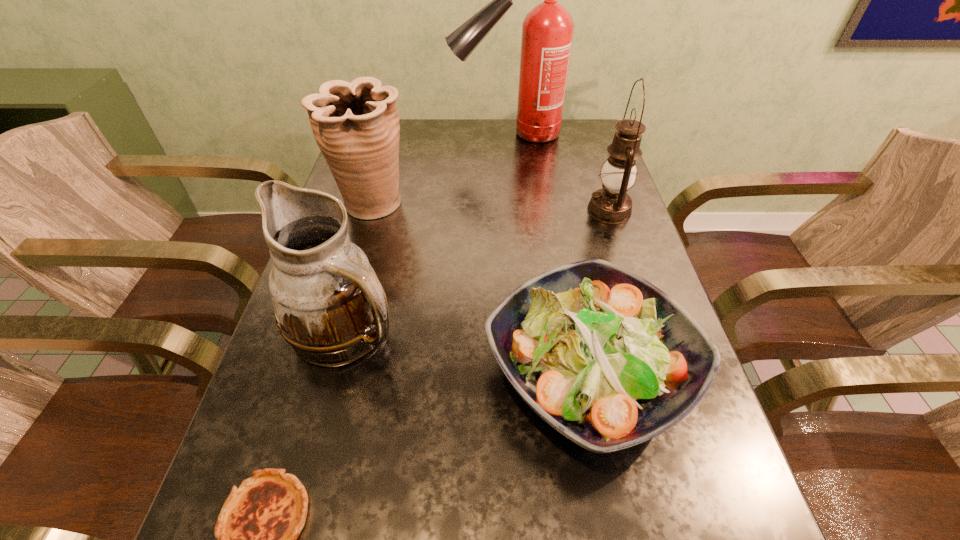
The height and width of the screenshot is (540, 960). In order to click on vacant point that satisfies the following two spatial constraints: 1. at the nozzle end of the farthest object; 2. on the front side of the urn in this screenshot , I will do `click(516, 204)`.

The image size is (960, 540). Identify the location of blank area in the image that satisfies the following two spatial constraints: 1. at the nozzle end of the fire extinguisher; 2. on the front side of the urn. (516, 204).

Locate an element on the screen. This screenshot has height=540, width=960. free location that satisfies the following two spatial constraints: 1. on the back side of the salad plate; 2. from the spout of the pitcher is located at coordinates (580, 330).

Identify the location of vacant point that satisfies the following two spatial constraints: 1. on the back side of the second shortest object; 2. on the left side of the oil lamp. (557, 210).